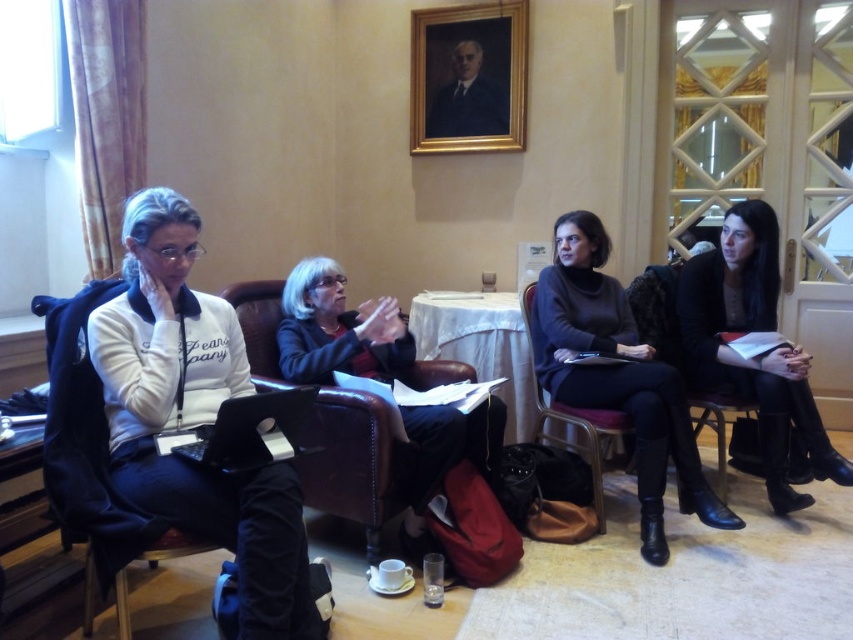
Question: Where is black leather jacket at right located in relation to metallic brown chair at center in the image?

Choices:
 (A) above
 (B) below

Answer: (A)

Question: Does white matte jacket at left appear over metallic brown chair at center?

Choices:
 (A) yes
 (B) no

Answer: (A)

Question: Which point is farther from the camera taking this photo?

Choices:
 (A) (508, 392)
 (B) (225, 387)

Answer: (A)

Question: Does velvet-like dark brown chair at left have a larger size compared to metallic brown chair at center?

Choices:
 (A) no
 (B) yes

Answer: (B)

Question: Among these objects, which one is farthest from the camera?

Choices:
 (A) dark gray sweater at center
 (B) white matte jacket at left

Answer: (A)

Question: Which object is positioned closest to the white matte jacket at left?

Choices:
 (A) velvet-like dark brown chair at left
 (B) matte black jacket at center

Answer: (A)